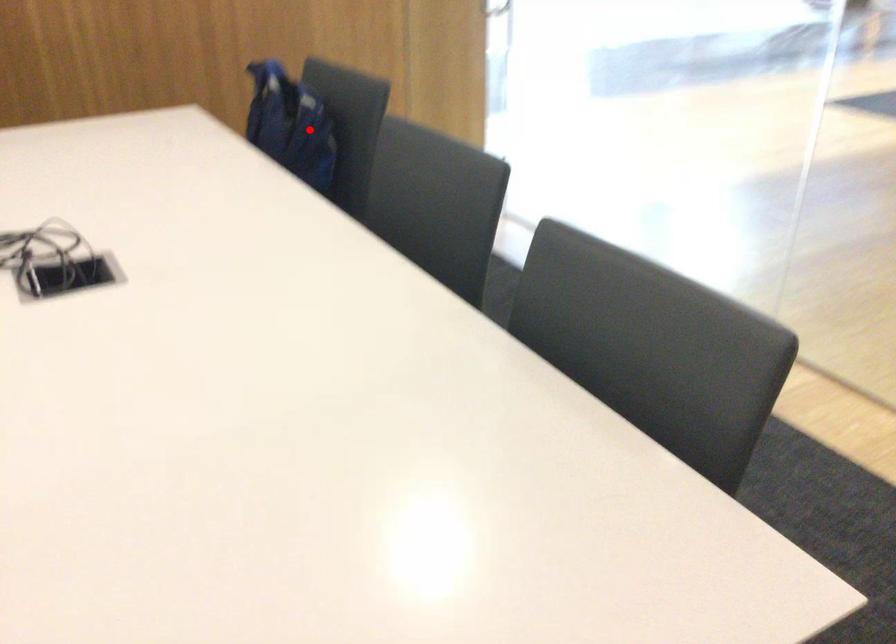
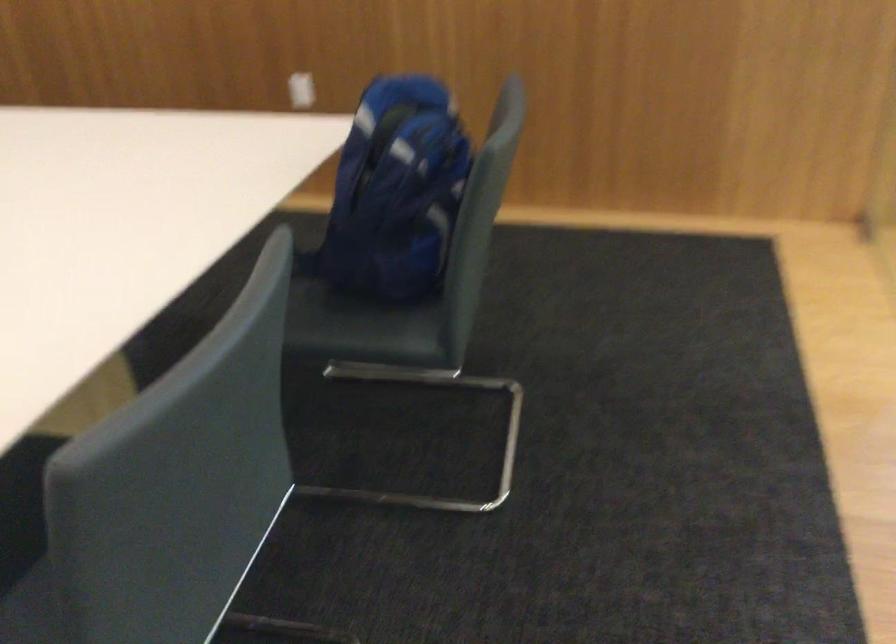
In the second image, find the point that corresponds to the highlighted location in the first image.

(395, 192)